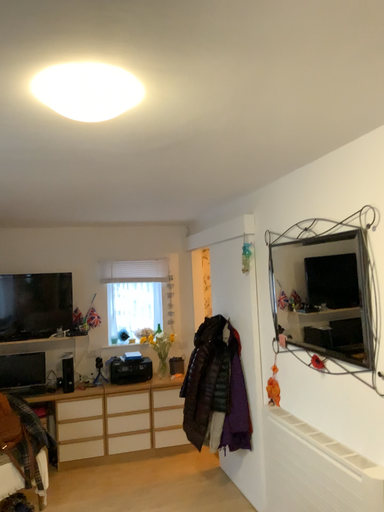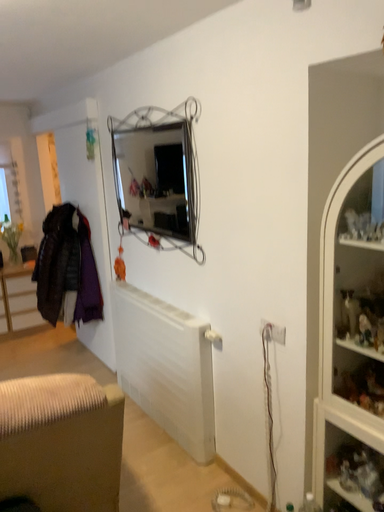
Question: Which way did the camera rotate in the video?

Choices:
 (A) rotated right
 (B) rotated left

Answer: (A)